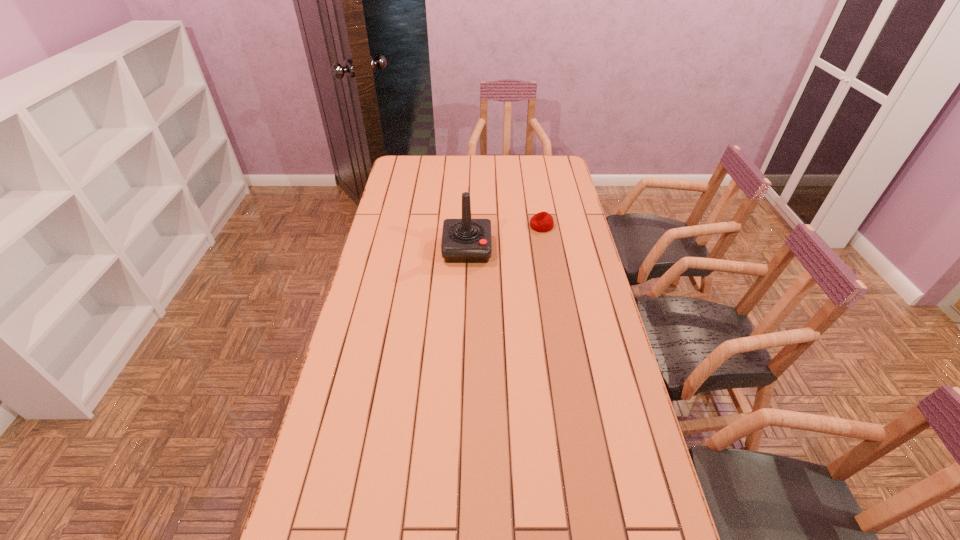
Where is `vacant region at the right edge of the desktop`? vacant region at the right edge of the desktop is located at coordinates (554, 254).

At what (x,y) coordinates should I click in order to perform the action: click on vacant space at the far right corner of the desktop. Please return your answer as a coordinate pair (x, y). Looking at the image, I should click on [x=558, y=178].

At what (x,y) coordinates should I click in order to perform the action: click on free space that satisfies the following two spatial constraints: 1. on the seat area of the beanbag; 2. on the front-facing side of the nearer object. Please return your answer as a coordinate pair (x, y). Looking at the image, I should click on (545, 249).

Locate an element on the screen. The width and height of the screenshot is (960, 540). vacant region that satisfies the following two spatial constraints: 1. on the seat area of the right object; 2. on the front-facing side of the taller object is located at coordinates (545, 249).

Where is `free space that satisfies the following two spatial constraints: 1. on the seat area of the shorter object; 2. on the front-facing side of the nearer object`? The height and width of the screenshot is (540, 960). free space that satisfies the following two spatial constraints: 1. on the seat area of the shorter object; 2. on the front-facing side of the nearer object is located at coordinates tap(545, 249).

This screenshot has height=540, width=960. I want to click on free spot that satisfies the following two spatial constraints: 1. on the seat area of the beanbag; 2. on the front-facing side of the nearer object, so click(x=545, y=249).

Locate an element on the screen. The image size is (960, 540). free point that satisfies the following two spatial constraints: 1. on the seat area of the beanbag; 2. on the front-facing side of the left object is located at coordinates (545, 249).

Find the location of a particular element. Image resolution: width=960 pixels, height=540 pixels. vacant point that satisfies the following two spatial constraints: 1. on the seat area of the farther object; 2. on the front-facing side of the nearer object is located at coordinates (545, 249).

Identify the location of free location that satisfies the following two spatial constraints: 1. on the seat area of the right object; 2. on the front-facing side of the nearer object. (545, 249).

Where is `vacant space that satisfies the following two spatial constraints: 1. on the seat area of the right object; 2. on the front-facing side of the nearer object`? The image size is (960, 540). vacant space that satisfies the following two spatial constraints: 1. on the seat area of the right object; 2. on the front-facing side of the nearer object is located at coordinates (545, 249).